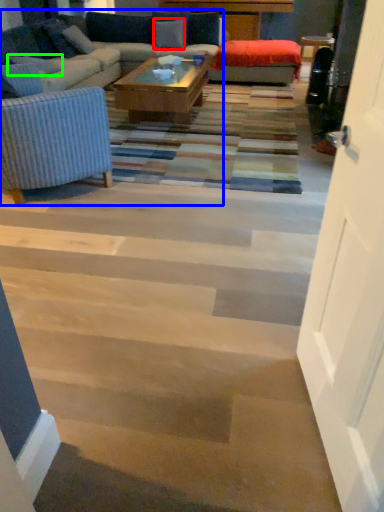
Question: Which is farther away from pillow (highlighted by a red box)? studio couch (highlighted by a blue box) or pillow (highlighted by a green box)?

Choices:
 (A) studio couch
 (B) pillow

Answer: (B)